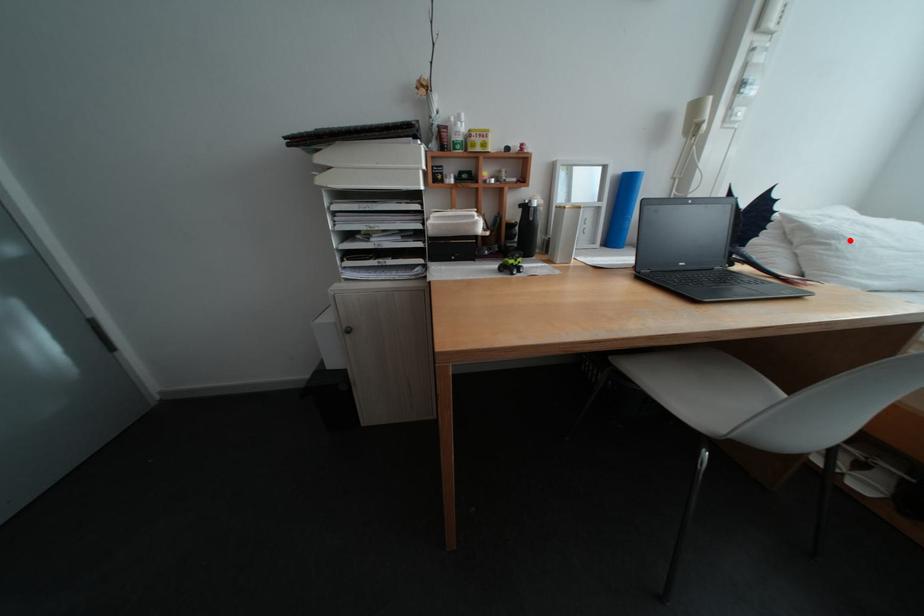
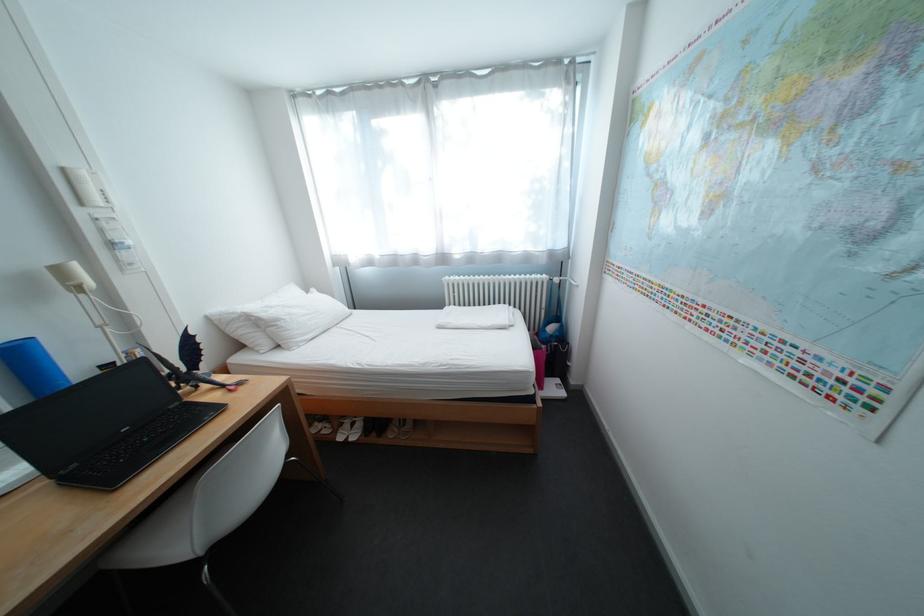
Where in the second image is the point corresponding to the highlighted location from the first image?

(292, 322)